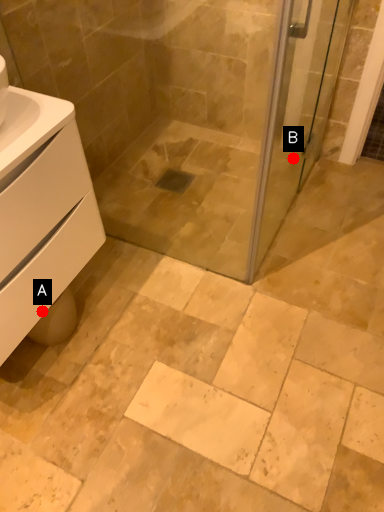
Question: Two points are circled on the image, labeled by A and B beside each circle. Among these points, which one is farthest from the camera?

Choices:
 (A) A is further
 (B) B is further

Answer: (B)